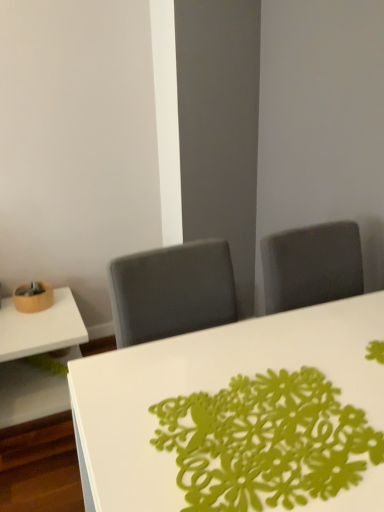
This screenshot has width=384, height=512. I want to click on vacant area on top of white glossy table at center, acting as the 1th table starting from the right (from a real-world perspective), so click(x=271, y=389).